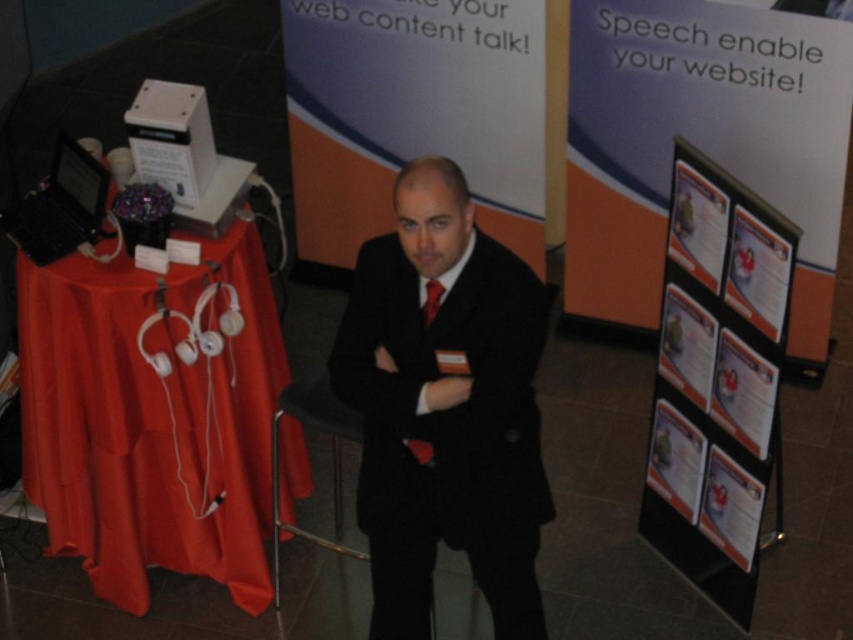
Does black matte suit at center appear on the left side of shiny red tie at center?

Incorrect, black matte suit at center is not on the left side of shiny red tie at center.

Is black matte suit at center to the right of shiny red tie at center from the viewer's perspective?

Yes, black matte suit at center is to the right of shiny red tie at center.

Who is more distant from viewer, (380,508) or (436,280)?

Positioned behind is point (380,508).

Where is `black matte suit at center`? This screenshot has width=853, height=640. black matte suit at center is located at coordinates (445, 408).

Does red silk tie at center appear on the right side of shiny red tie at center?

Correct, you'll find red silk tie at center to the right of shiny red tie at center.

This screenshot has width=853, height=640. Identify the location of red silk tie at center. [x=431, y=300].

Does point (425, 314) lie behind point (422, 316)?

No, (425, 314) is closer to viewer.

This screenshot has width=853, height=640. What are the coordinates of `red silk tie at center` in the screenshot? It's located at (431, 300).

Who is lower down, orange fabric table at left or black matte suit at center?

orange fabric table at left

From the picture: Who is taller, orange fabric table at left or black matte suit at center?

black matte suit at center is taller.

This screenshot has width=853, height=640. I want to click on orange fabric table at left, so click(154, 413).

At what (x,y) coordinates should I click in order to perform the action: click on orange fabric table at left. Please return your answer as a coordinate pair (x, y). Looking at the image, I should click on (154, 413).